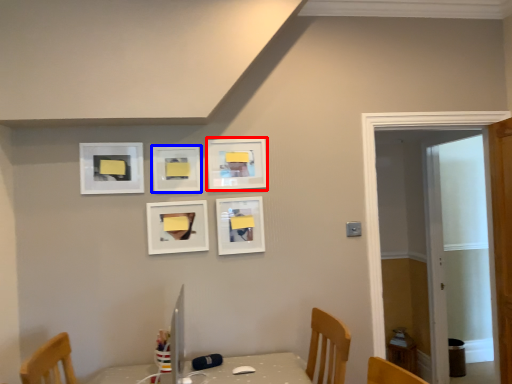
Question: Which object is closer to the camera taking this photo, picture frame (highlighted by a red box) or picture frame (highlighted by a blue box)?

Choices:
 (A) picture frame
 (B) picture frame

Answer: (B)